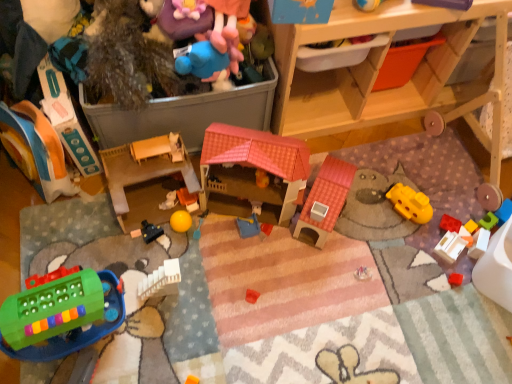
This screenshot has width=512, height=384. What are the coordinates of `free space in front of blue plastic toy at center, the ninth toy positioned from the left` in the screenshot? It's located at (242, 276).